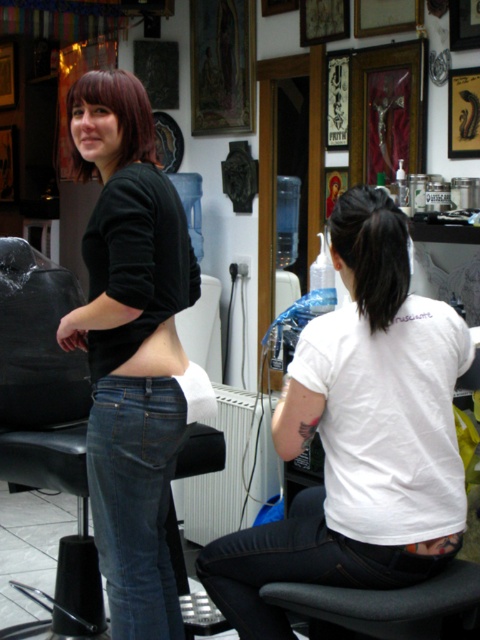
Is the position of denim jeans at center less distant than that of black matte ponytail at center back?

No, denim jeans at center is further to the viewer.

Does denim jeans at center have a greater width compared to black matte ponytail at center back?

Correct, the width of denim jeans at center exceeds that of black matte ponytail at center back.

The height and width of the screenshot is (640, 480). What do you see at coordinates (135, 499) in the screenshot?
I see `denim jeans at center` at bounding box center [135, 499].

Identify the location of denim jeans at center. This screenshot has height=640, width=480. (135, 499).

Which of these two, denim jeans at center or dark brown hair at upper left, stands taller?

Standing taller between the two is denim jeans at center.

Based on the photo, is denim jeans at center smaller than dark brown hair at upper left?

No.

Who is more distant from viewer, (143, 541) or (137, 148)?

The point (137, 148) is behind.

Where is `denim jeans at center`? This screenshot has height=640, width=480. denim jeans at center is located at coordinates (135, 499).

Can you confirm if white matte shirt at center is smaller than denim jeans at center?

No.

Does white matte shirt at center appear over denim jeans at center?

Indeed, white matte shirt at center is positioned over denim jeans at center.

Which is in front, point (388, 291) or point (172, 420)?

Point (388, 291) is in front.

Find the location of a particular element. white matte shirt at center is located at coordinates (360, 435).